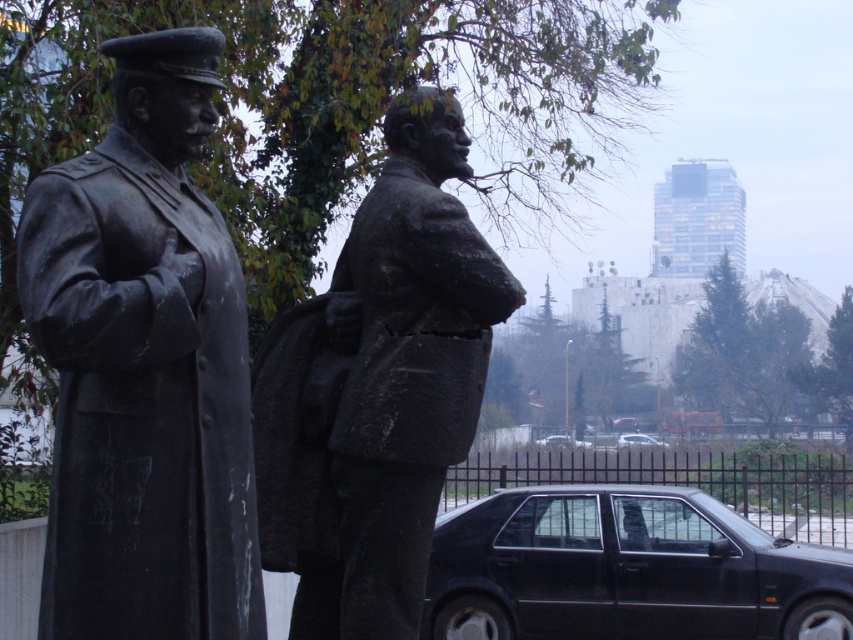
Is black matte car at lower right positioned before black glossy car at center?

Yes.

Is point (839, 556) positioned in front of point (553, 436)?

Yes, it is.

Locate an element on the screen. The image size is (853, 640). black matte car at lower right is located at coordinates (625, 570).

Is point (138, 550) less distant than point (756, 563)?

Yes, point (138, 550) is closer to viewer.

Does bronze statue at left come behind black matte car at lower right?

That is False.

In order to click on bronze statue at left in this screenshot , I will do `click(144, 368)`.

Is bronze statue at center below black matte car at lower right?

Incorrect, bronze statue at center is not positioned below black matte car at lower right.

Does bronze statue at center come in front of black matte car at lower right?

Yes.

Is point (352, 560) behind point (589, 515)?

No, it is in front of (589, 515).

In order to click on bronze statue at center in this screenshot , I will do `click(378, 388)`.